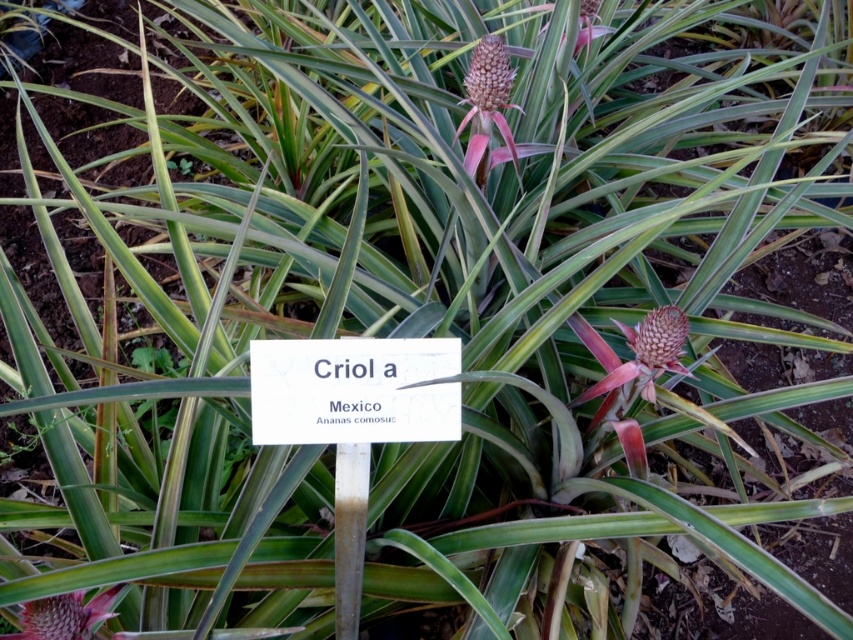
You are a botanist examining two pineapples on a plant. You need to determine which pineapple is larger. The pineapples are the pink spiky pineapple at upper center and the brown fuzzy pineapple at center. Which one is bigger?

Result: The pink spiky pineapple at upper center is bigger than the brown fuzzy pineapple at center.

You are a botanist examining two pink spiky pineapples in the image. The first is labeled as the pink spiky pineapple at upper center and the second as the pink spiky pineapple at center. Which of these pineapples has a greater width?

The pink spiky pineapple at upper center has a greater width than the pink spiky pineapple at center.